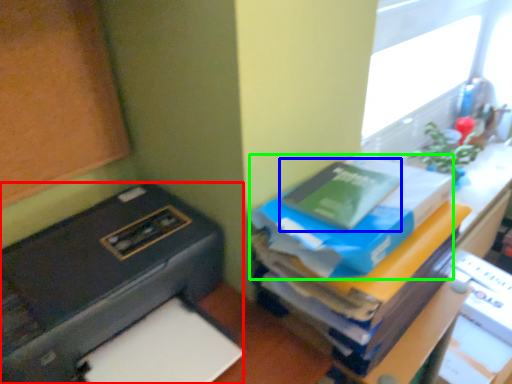
Question: Which object is positioned farthest from printer (highlighted by a red box)? Select from paperback book (highlighted by a blue box) and paperback book (highlighted by a green box).

Choices:
 (A) paperback book
 (B) paperback book

Answer: (A)